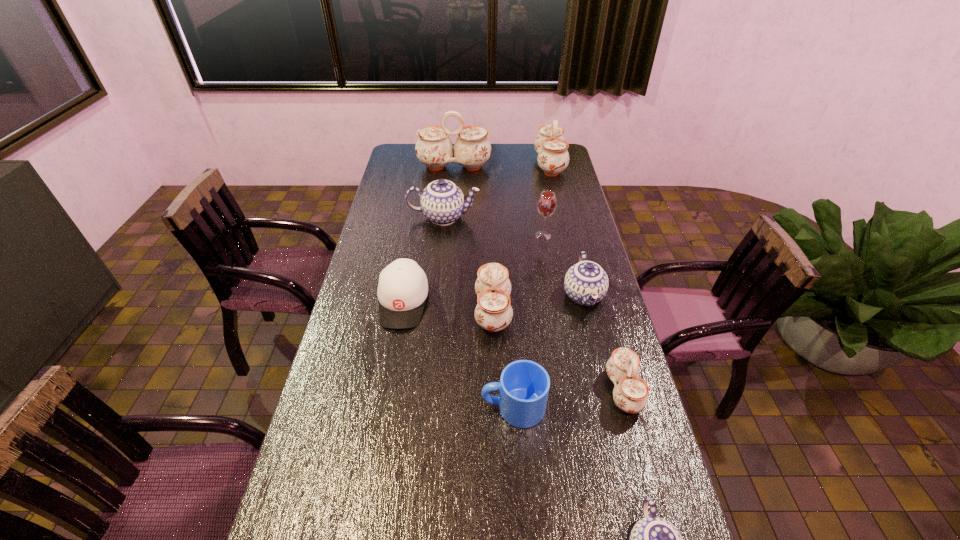
Locate an element on the screen. This screenshot has width=960, height=540. the tallest chinaware is located at coordinates (472, 148).

Where is `the tallest object`? This screenshot has height=540, width=960. the tallest object is located at coordinates (472, 148).

Where is `the third smallest white chinaware`? the third smallest white chinaware is located at coordinates (553, 157).

You are a GUI agent. You are given a task and a screenshot of the screen. Output one action in this format:
    pyautogui.click(x=<x>, y=<y>)
    Task: Click on the fourth farthest object
    The image size is (960, 540).
    Given the screenshot: What is the action you would take?
    pyautogui.click(x=547, y=203)

Where is `wineglass`? The height and width of the screenshot is (540, 960). wineglass is located at coordinates (547, 203).

Identify the location of the second nearest white chinaware. The image size is (960, 540). (493, 312).

Where is `the leftmost blue chinaware`? the leftmost blue chinaware is located at coordinates (442, 202).

At what (x,y) coordinates should I click in order to perform the action: click on the fifth nearest chinaware. Please return your answer as a coordinate pair (x, y). The height and width of the screenshot is (540, 960). Looking at the image, I should click on (442, 202).

Locate an element on the screen. the second smallest blue chinaware is located at coordinates (586, 283).

Locate an element on the screen. This screenshot has width=960, height=540. the nearest white chinaware is located at coordinates (631, 394).